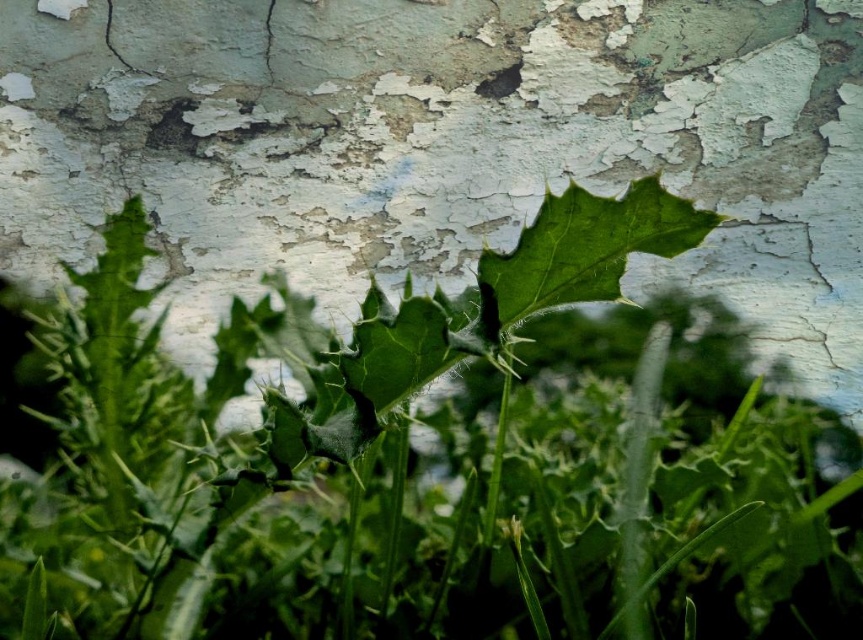
You are standing in front of the wall with peeling paint and green plants. You notice two points marked on the wall at coordinates point (191, 541) and point (567, 230). Which point is closer to you?

Point (191, 541) is closer to you because it is further to the viewer than point (567, 230).

You are an artist sketching the scene and want to draw the green spiky leaf at center and the green matte leaf at center. Which leaf should you draw first if you want to follow the natural left to right order of their positions?

The green spiky leaf at center should be drawn first since it is positioned to the left of the green matte leaf at center, following the left to right order.